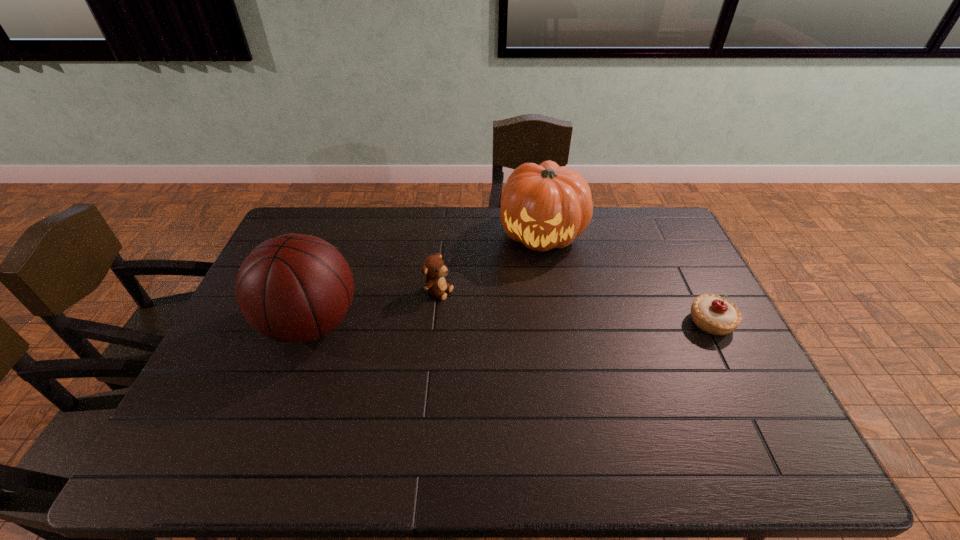
The height and width of the screenshot is (540, 960). In order to click on vacant space that is in between the farthest object and the third object from right to left in this screenshot , I will do `click(491, 262)`.

Image resolution: width=960 pixels, height=540 pixels. Identify the location of the closest object relative to the basketball. [x=434, y=267].

Select which object is the third closest to the teddy bear. Please provide its 2D coordinates. Your answer should be formatted as a tuple, i.e. [(x, y)], where the tuple contains the x and y coordinates of a point satisfying the conditions above.

[(715, 315)]

I want to click on free space that satisfies the following two spatial constraints: 1. on the back side of the basketball; 2. on the right side of the rightmost object, so click(311, 322).

Find the location of a particular element. Image resolution: width=960 pixels, height=540 pixels. free space that satisfies the following two spatial constraints: 1. on the front side of the pumpkin; 2. on the right side of the pastry is located at coordinates (557, 322).

Locate an element on the screen. free point that satisfies the following two spatial constraints: 1. on the front side of the teddy bear; 2. on the right side of the shortest object is located at coordinates (436, 322).

Where is `free region that satisfies the following two spatial constraints: 1. on the front side of the pumpkin; 2. on the left side of the pastry`? The image size is (960, 540). free region that satisfies the following two spatial constraints: 1. on the front side of the pumpkin; 2. on the left side of the pastry is located at coordinates (557, 322).